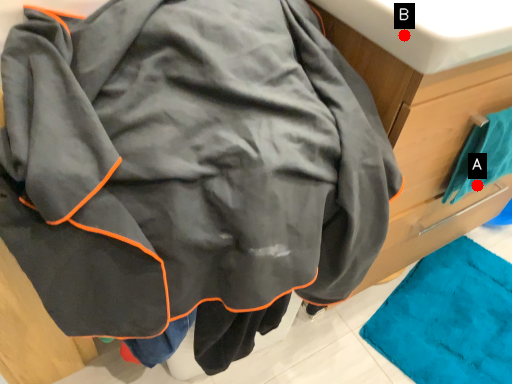
Question: Two points are circled on the image, labeled by A and B beside each circle. Among these points, which one is nearest to the camera?

Choices:
 (A) A is closer
 (B) B is closer

Answer: (B)